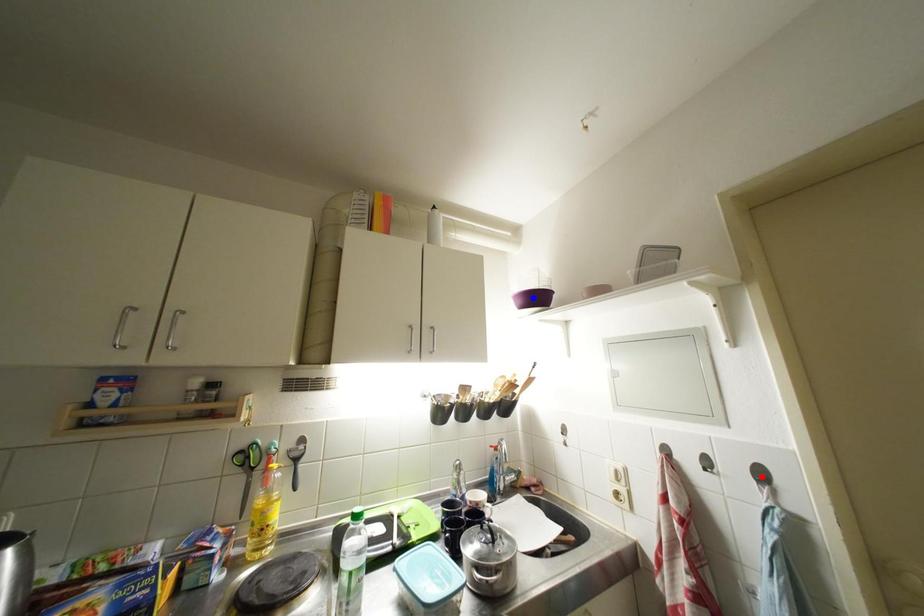
Question: Two points are marked on the image. Which point is closer to the camera?

Choices:
 (A) Blue point is closer.
 (B) Red point is closer.

Answer: (B)